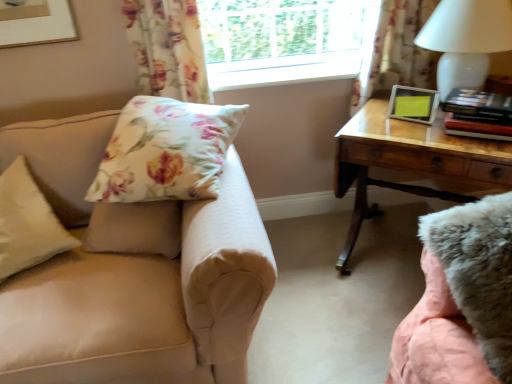
Question: From a real-world perspective, is hardcover books at right positioned above or below floral fabric curtain at upper left, marked as the first curtain in a left-to-right arrangement?

Choices:
 (A) above
 (B) below

Answer: (B)

Question: From the image's perspective, is hardcover books at right positioned above or below floral fabric curtain at upper left, marked as the first curtain in a left-to-right arrangement?

Choices:
 (A) above
 (B) below

Answer: (B)

Question: Which object is positioned closest to the hardcover books at right?

Choices:
 (A) floral fabric curtain at upper left, marked as the first curtain in a left-to-right arrangement
 (B) floral fabric pillow at upper left, placed as the second pillow when sorted from left to right
 (C) white glossy table lamp at upper right
 (D) white plastic window frame at upper center
 (E) beige fabric pillow at left, which appears as the 2th pillow when viewed from the right

Answer: (C)

Question: Considering the real-world distances, which object is farthest from the floral fabric pillow at upper left, the 1th pillow when ordered from right to left?

Choices:
 (A) beige fabric pillow at left, which appears as the 2th pillow when viewed from the right
 (B) white plastic window frame at upper center
 (C) floral fabric curtain at upper right, the 2th curtain when ordered from left to right
 (D) wooden desk at right
 (E) transparent glass window at upper center

Answer: (C)